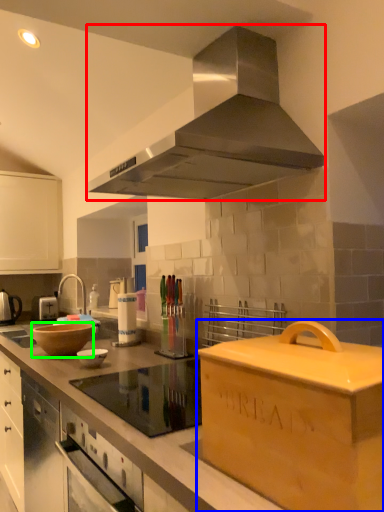
Question: Which object is positioned closest to home appliance (highlighted by a red box)? Select from cardboard box (highlighted by a blue box) and mixing bowl (highlighted by a green box).

Choices:
 (A) cardboard box
 (B) mixing bowl

Answer: (A)